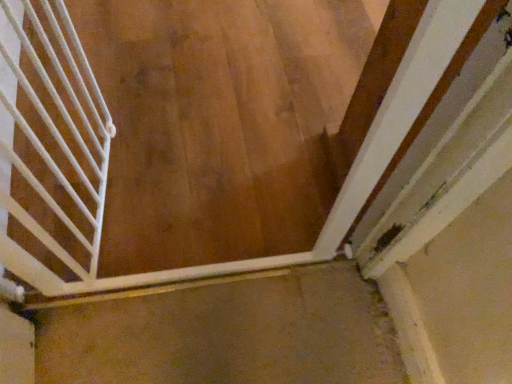
Find the location of a particular element. The height and width of the screenshot is (384, 512). white plastic gate at left is located at coordinates (54, 127).

The image size is (512, 384). Describe the element at coordinates (54, 127) in the screenshot. I see `white plastic gate at left` at that location.

Find the location of a particular element. This screenshot has height=384, width=512. white plastic gate at left is located at coordinates tap(54, 127).